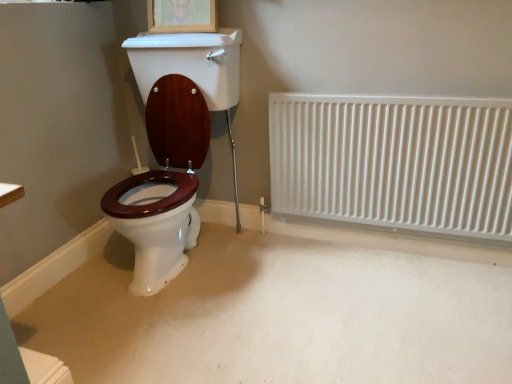
Identify the location of white metallic radiator at right. This screenshot has width=512, height=384. (394, 162).

What is the approximate height of white metallic radiator at right?

It is 29.02 inches.

The height and width of the screenshot is (384, 512). What do you see at coordinates (394, 162) in the screenshot?
I see `white metallic radiator at right` at bounding box center [394, 162].

At what (x,y) coordinates should I click in order to perform the action: click on wooden picture frame at upper center. Please return your answer as a coordinate pair (x, y). Looking at the image, I should click on (182, 16).

This screenshot has height=384, width=512. Describe the element at coordinates (182, 16) in the screenshot. I see `wooden picture frame at upper center` at that location.

Locate an element on the screen. The image size is (512, 384). white metallic radiator at right is located at coordinates (394, 162).

Considering the positions of objects wooden picture frame at upper center and white metallic radiator at right in the image provided, who is more to the left, wooden picture frame at upper center or white metallic radiator at right?

Positioned to the left is wooden picture frame at upper center.

Relative to white metallic radiator at right, is wooden picture frame at upper center in front or behind?

Clearly, wooden picture frame at upper center is behind white metallic radiator at right.

Considering the points (212, 1) and (493, 153), which point is behind, point (212, 1) or point (493, 153)?

Point (212, 1)

From the image's perspective, is wooden picture frame at upper center positioned above or below white metallic radiator at right?

Clearly, from the image's perspective, wooden picture frame at upper center is above white metallic radiator at right.

Based on the photo, from a real-world perspective, is wooden picture frame at upper center above or below white metallic radiator at right?

From a real-world perspective, wooden picture frame at upper center is physically above white metallic radiator at right.

Which object is thinner, wooden picture frame at upper center or white metallic radiator at right?

Thinner between the two is white metallic radiator at right.

In terms of height, does wooden picture frame at upper center look taller or shorter compared to white metallic radiator at right?

In the image, wooden picture frame at upper center appears to be shorter than white metallic radiator at right.

Can you confirm if wooden picture frame at upper center is bigger than white metallic radiator at right?

Actually, wooden picture frame at upper center might be smaller than white metallic radiator at right.

Is wooden picture frame at upper center surrounding white metallic radiator at right?

Actually, white metallic radiator at right is outside wooden picture frame at upper center.

Are wooden picture frame at upper center and white metallic radiator at right located far from each other?

No, there isn't a large distance between wooden picture frame at upper center and white metallic radiator at right.

Is wooden picture frame at upper center positioned with its back to white metallic radiator at right?

No, white metallic radiator at right is not at the back of wooden picture frame at upper center.

How different are the orientations of wooden picture frame at upper center and white metallic radiator at right in degrees?

The angular difference between wooden picture frame at upper center and white metallic radiator at right is 0.481 degrees.

Where is `picture frame lying behind the white metallic radiator at right`? This screenshot has width=512, height=384. picture frame lying behind the white metallic radiator at right is located at coordinates (182, 16).

Which is more to the right, white metallic radiator at right or wooden picture frame at upper center?

white metallic radiator at right.

Which is in front, white metallic radiator at right or wooden picture frame at upper center?

white metallic radiator at right is closer to the camera.

Is point (495, 134) closer to camera compared to point (151, 10)?

That is True.

From the image's perspective, relative to wooden picture frame at upper center, is white metallic radiator at right above or below?

From the image's perspective, white metallic radiator at right appears below wooden picture frame at upper center.

From a real-world perspective, which object stands above the other?

wooden picture frame at upper center.

Is white metallic radiator at right thinner than wooden picture frame at upper center?

Yes.

Who is shorter, white metallic radiator at right or wooden picture frame at upper center?

wooden picture frame at upper center.

Between white metallic radiator at right and wooden picture frame at upper center, which one has larger size?

Bigger between the two is white metallic radiator at right.

Would you say wooden picture frame at upper center is part of white metallic radiator at right's contents?

No.

Would you consider white metallic radiator at right to be distant from wooden picture frame at upper center?

Actually, white metallic radiator at right and wooden picture frame at upper center are a little close together.

Is white metallic radiator at right turned away from wooden picture frame at upper center?

No, white metallic radiator at right is not facing away from wooden picture frame at upper center.

The image size is (512, 384). Identify the location of picture frame behind the white metallic radiator at right. (182, 16).

The width and height of the screenshot is (512, 384). I want to click on picture frame above the white metallic radiator at right (from the image's perspective), so click(x=182, y=16).

This screenshot has height=384, width=512. Find the location of `picture frame lying behind the white metallic radiator at right`. picture frame lying behind the white metallic radiator at right is located at coordinates (182, 16).